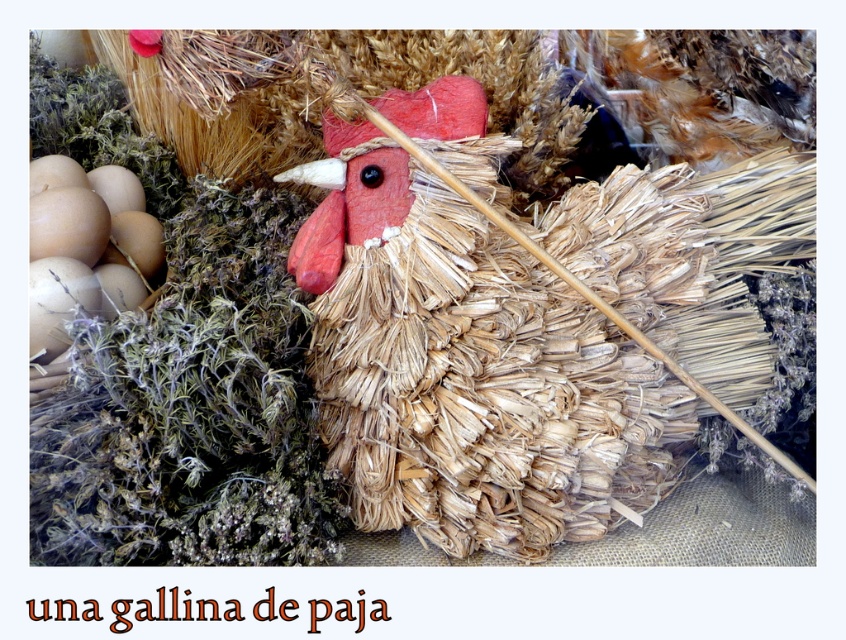
Does straw-like textured chicken at center appear over brown matte eggs at left?

No, straw-like textured chicken at center is not above brown matte eggs at left.

Is straw-like textured chicken at center wider than brown matte eggs at left?

Indeed, straw-like textured chicken at center has a greater width compared to brown matte eggs at left.

Describe the element at coordinates (468, 368) in the screenshot. I see `straw-like textured chicken at center` at that location.

You are a GUI agent. You are given a task and a screenshot of the screen. Output one action in this format:
    pyautogui.click(x=<x>, y=<y>)
    Task: Click on the straw-like textured chicken at center
    Image resolution: width=846 pixels, height=640 pixels.
    Given the screenshot: What is the action you would take?
    pyautogui.click(x=468, y=368)